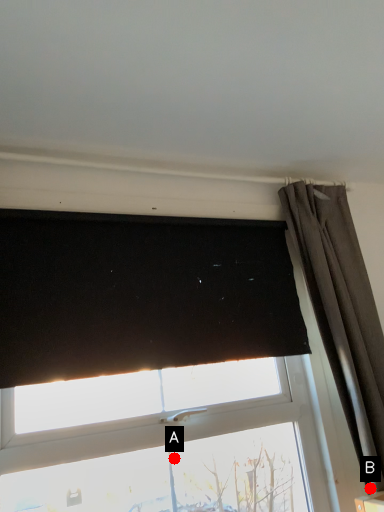
Question: Two points are circled on the image, labeled by A and B beside each circle. Which of the following is the closest to the observer?

Choices:
 (A) A is closer
 (B) B is closer

Answer: (B)